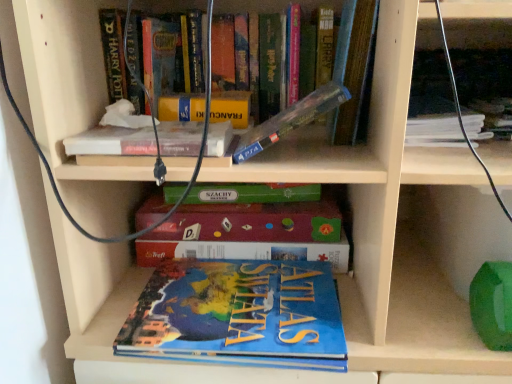
Question: From the image's perspective, would you say hardcover book at upper right, which is the 2th book from top to bottom, is positioned over white matte book at upper center, the fourth book when ordered from top to bottom?

Choices:
 (A) yes
 (B) no

Answer: (A)

Question: From a real-world perspective, is hardcover book at upper right, positioned as the fifth book in bottom-to-top order, physically below white matte book at upper center, the fourth book when ordered from top to bottom?

Choices:
 (A) yes
 (B) no

Answer: (B)

Question: Considering the relative sizes of hardcover book at upper right, positioned as the fifth book in bottom-to-top order, and white matte book at upper center, the fourth book when ordered from top to bottom, in the image provided, is hardcover book at upper right, positioned as the fifth book in bottom-to-top order, shorter than white matte book at upper center, the fourth book when ordered from top to bottom,?

Choices:
 (A) no
 (B) yes

Answer: (A)

Question: From the image's perspective, does hardcover book at upper right, positioned as the fifth book in bottom-to-top order, appear lower than white matte book at upper center, which appears as the 3th book when ordered from the bottom?

Choices:
 (A) yes
 (B) no

Answer: (B)

Question: Considering the relative sizes of hardcover book at upper right, positioned as the fifth book in bottom-to-top order, and white matte book at upper center, which appears as the 3th book when ordered from the bottom, in the image provided, is hardcover book at upper right, positioned as the fifth book in bottom-to-top order, smaller than white matte book at upper center, which appears as the 3th book when ordered from the bottom,?

Choices:
 (A) yes
 (B) no

Answer: (B)

Question: Does hardcover book at upper right, positioned as the fifth book in bottom-to-top order, appear on the left side of white matte book at upper center, the fourth book when ordered from top to bottom?

Choices:
 (A) no
 (B) yes

Answer: (A)

Question: Is clear plastic case at upper center, marked as the third book in a top-to-bottom arrangement, in contact with blue matte atlas of the world at lower center, which is the 1th book from bottom to top?

Choices:
 (A) no
 (B) yes

Answer: (A)

Question: Is clear plastic case at upper center, marked as the third book in a top-to-bottom arrangement, in front of blue matte atlas of the world at lower center, arranged as the 6th book when viewed from the top?

Choices:
 (A) yes
 (B) no

Answer: (A)

Question: Is clear plastic case at upper center, the fourth book positioned from the bottom, oriented away from blue matte atlas of the world at lower center, which is the 1th book from bottom to top?

Choices:
 (A) yes
 (B) no

Answer: (B)

Question: Is clear plastic case at upper center, marked as the third book in a top-to-bottom arrangement, at the right side of blue matte atlas of the world at lower center, which is the 1th book from bottom to top?

Choices:
 (A) yes
 (B) no

Answer: (A)

Question: From a real-world perspective, is clear plastic case at upper center, marked as the third book in a top-to-bottom arrangement, over blue matte atlas of the world at lower center, arranged as the 6th book when viewed from the top?

Choices:
 (A) no
 (B) yes

Answer: (B)

Question: Is clear plastic case at upper center, marked as the third book in a top-to-bottom arrangement, facing towards blue matte atlas of the world at lower center, arranged as the 6th book when viewed from the top?

Choices:
 (A) yes
 (B) no

Answer: (B)

Question: Can you confirm if hardcover book at upper center, positioned as the sixth book in bottom-to-top order, is thinner than yellow matte book at upper center?

Choices:
 (A) no
 (B) yes

Answer: (A)